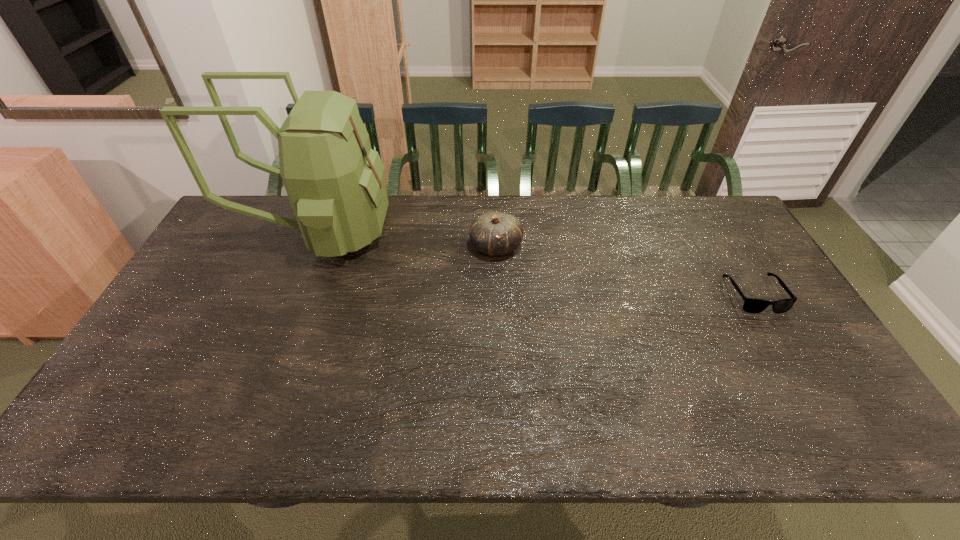
You are a GUI agent. You are given a task and a screenshot of the screen. Output one action in this format:
    pyautogui.click(x=<x>, y=<y>)
    Task: Click on the vacant point located between the sunglasses and the leftmost object
    The width and height of the screenshot is (960, 540).
    Given the screenshot: What is the action you would take?
    pyautogui.click(x=537, y=264)

Locate an element on the screen. The image size is (960, 540). free space between the gourd and the sunglasses is located at coordinates (625, 271).

Where is `free space between the tallest object and the rightmost object`? The image size is (960, 540). free space between the tallest object and the rightmost object is located at coordinates (537, 264).

This screenshot has height=540, width=960. Find the location of `free space between the tallest object and the second shortest object`. free space between the tallest object and the second shortest object is located at coordinates (407, 240).

Locate an element on the screen. free space between the rightmost object and the tallest object is located at coordinates (537, 264).

Identify the location of free space between the sunglasses and the gourd. click(625, 271).

Locate an element on the screen. This screenshot has height=540, width=960. free space that is in between the second object from right to left and the tallest object is located at coordinates (407, 240).

What are the coordinates of `unoccupied area between the rightmost object and the backpack` in the screenshot? It's located at (537, 264).

This screenshot has width=960, height=540. Find the location of `free spot between the backpack and the sunglasses`. free spot between the backpack and the sunglasses is located at coordinates (537, 264).

Locate an element on the screen. The image size is (960, 540). free space between the backpack and the second tallest object is located at coordinates (407, 240).